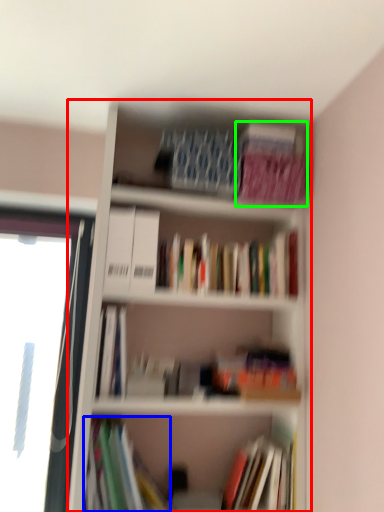
Question: Which object is positioned farthest from bookcase (highlighted by a red box)? Select from book (highlighted by a blue box) and paperback book (highlighted by a green box).

Choices:
 (A) book
 (B) paperback book

Answer: (A)